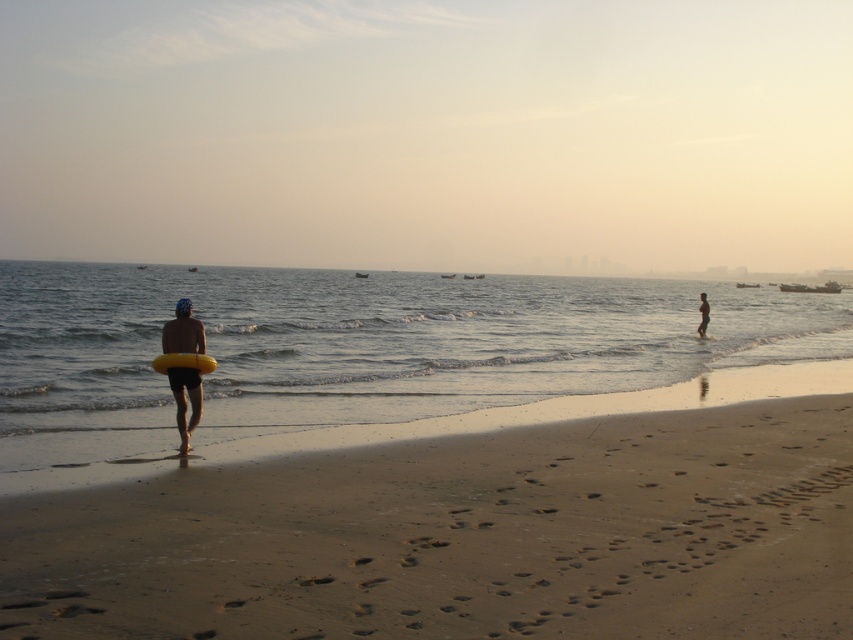
Is yellow foam surfboard at center taller than smooth skin man at right?

No.

Which of these two, yellow foam surfboard at center or smooth skin man at right, stands taller?

Standing taller between the two is smooth skin man at right.

Identify the location of yellow foam surfboard at center. (183, 362).

Where is `yellow foam surfboard at center`? yellow foam surfboard at center is located at coordinates (183, 362).

Can you confirm if sandy yellow at lower left is positioned to the right of yellow rubber ring at left?

Correct, you'll find sandy yellow at lower left to the right of yellow rubber ring at left.

Is sandy yellow at lower left smaller than yellow rubber ring at left?

Yes, sandy yellow at lower left is smaller than yellow rubber ring at left.

Identify the location of sandy yellow at lower left. (473, 525).

Does sandy yellow at lower left come behind yellow rubber ring at center?

No, sandy yellow at lower left is closer to the viewer.

Is sandy yellow at lower left to the left of yellow rubber ring at center from the viewer's perspective?

No, sandy yellow at lower left is not to the left of yellow rubber ring at center.

You are a GUI agent. You are given a task and a screenshot of the screen. Output one action in this format:
    pyautogui.click(x=<x>, y=<y>)
    Task: Click on the sandy yellow at lower left
    
    Given the screenshot: What is the action you would take?
    pyautogui.click(x=473, y=525)

Locate an element on the screen. Image resolution: width=853 pixels, height=640 pixels. sandy yellow at lower left is located at coordinates (473, 525).